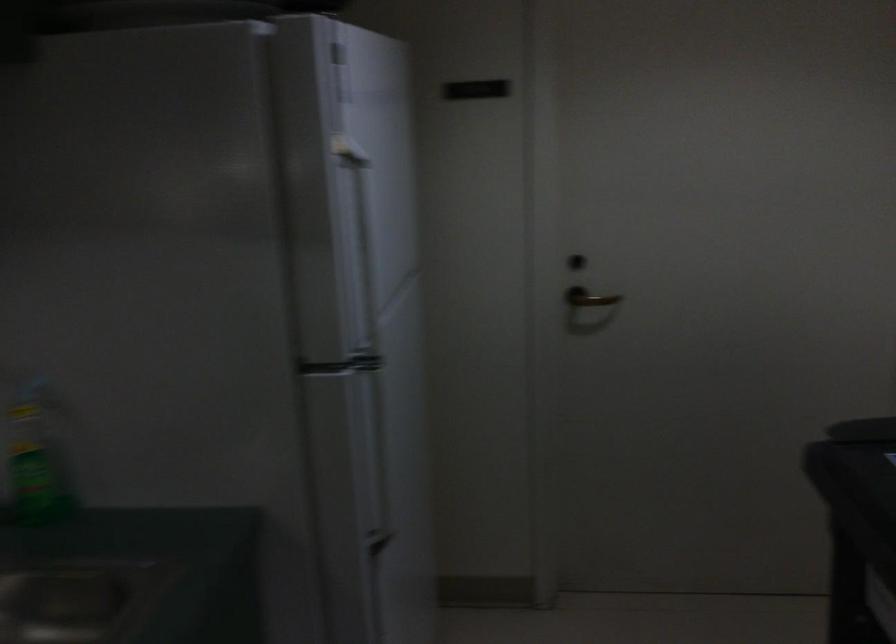
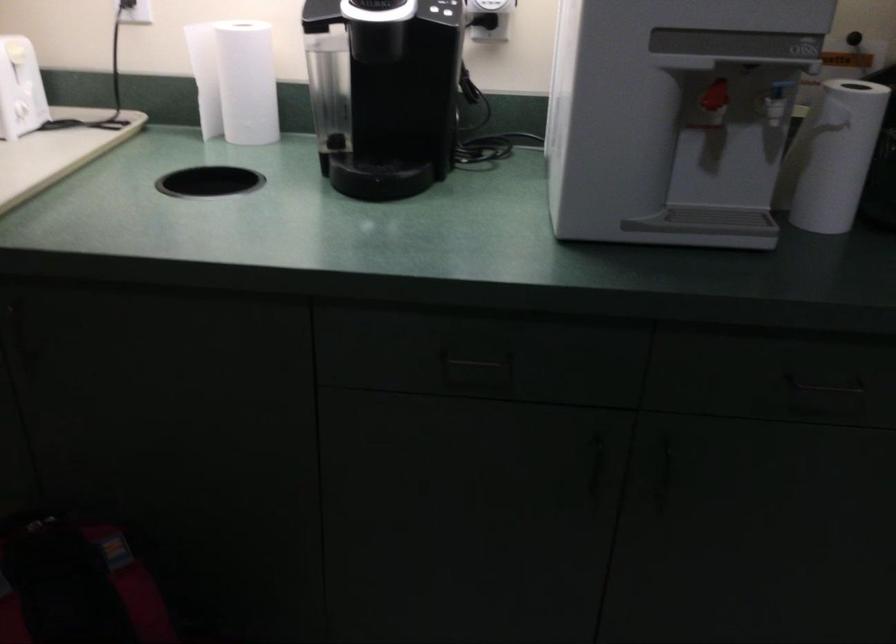
Based on the continuous images, in which direction is the camera rotating?

The camera rotated toward left-down.